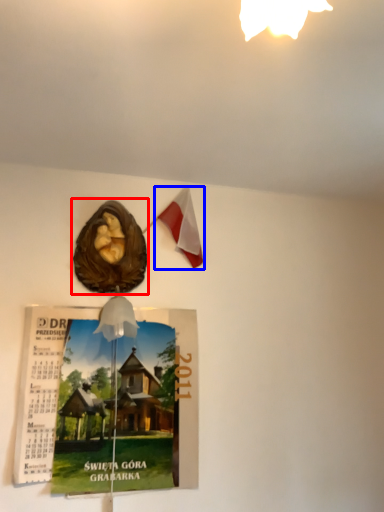
Question: Which object is further to the camera taking this photo, flyer (highlighted by a red box) or flag (highlighted by a blue box)?

Choices:
 (A) flyer
 (B) flag

Answer: (B)